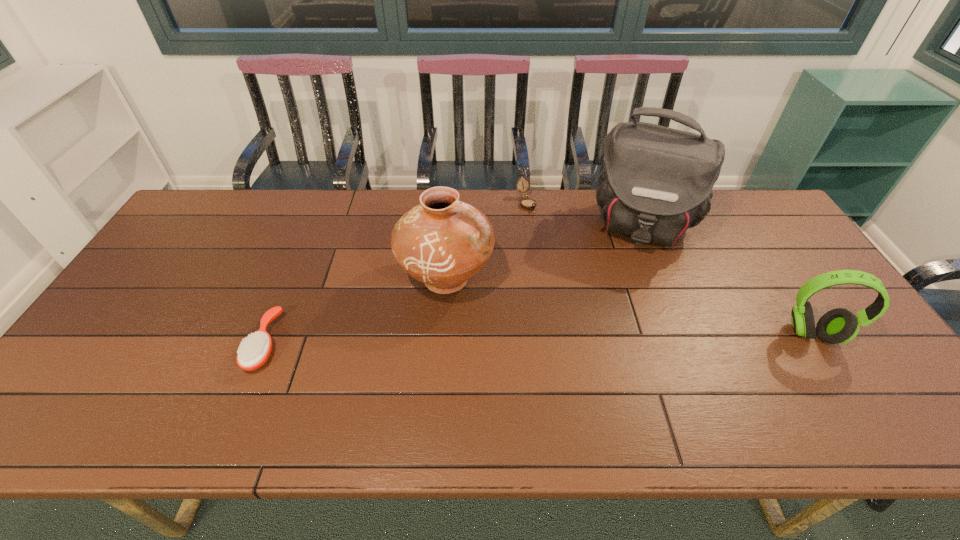
Locate an element on the screen. vacant space that satisfies the following two spatial constraints: 1. on the front side of the pottery; 2. on the right side of the rightmost object is located at coordinates pyautogui.click(x=443, y=334).